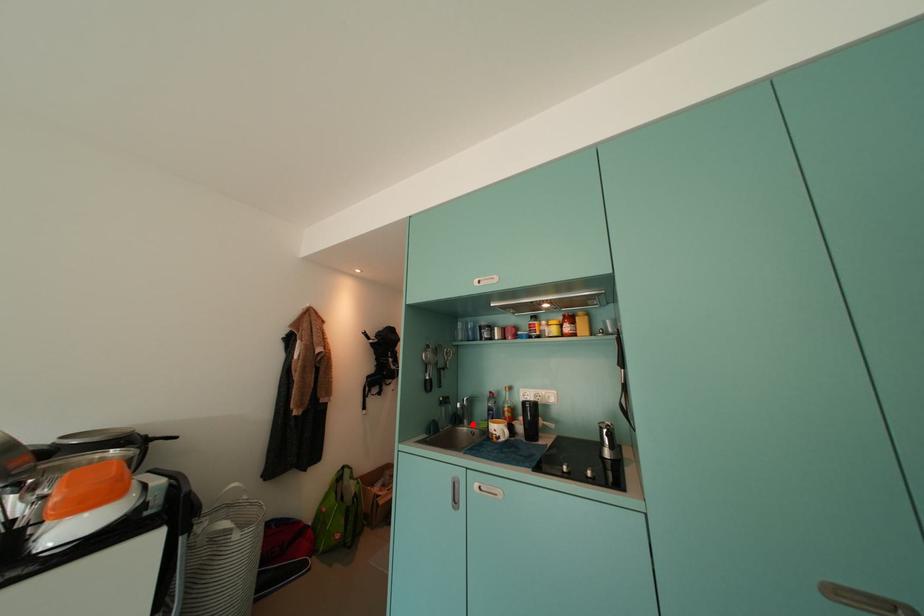
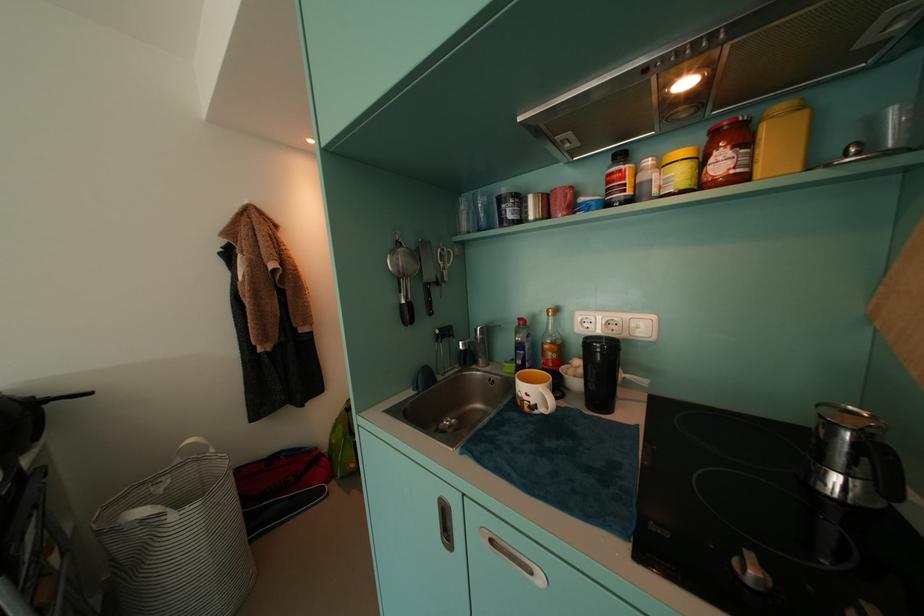
Locate, in the second image, the point that corresponds to the highlighted location in the first image.

(488, 363)